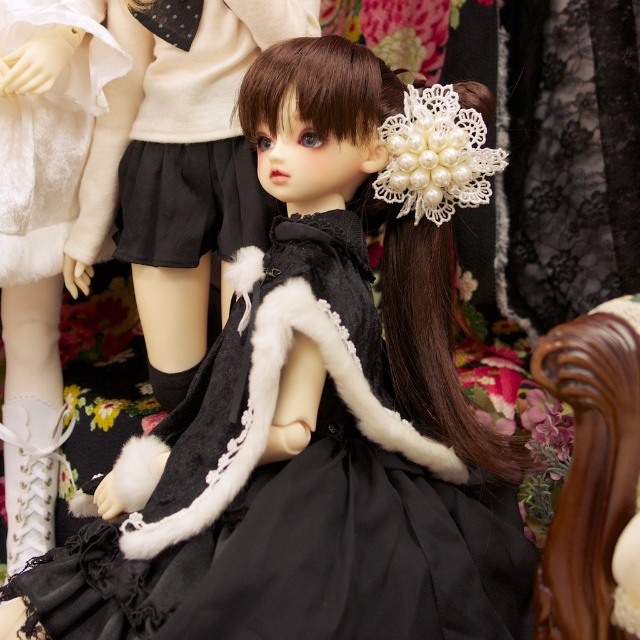
You are a doll collector trying to place a new doll on the brown polished wood chair at right. The doll has white fur boots at lower left that are wider than the chair. Will the boots fit on the chair?

The white fur boots at lower left are wider than the brown polished wood chair at right, so the boots will not fit on the chair.

You are a doll collector examining the image. You notice a point at coordinates (40,234). What object is located at this point?

The point at coordinates (40,234) marks the white fur boots at lower left.

You are an artist trying to paint this doll collection. You want to ensure that the point at coordinates point [40,189] and point [275,17] are positioned correctly in your painting. According to the image, which point is closer to the viewer?

Point [275,17] is closer to the viewer because the description states that point [40,189] is behind point [275,17].